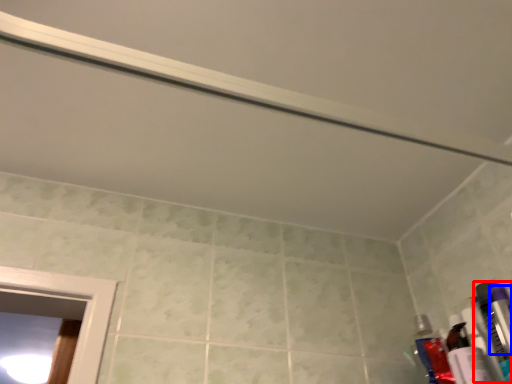
Question: Among these objects, which one is farthest to the camera, toiletry (highlighted by a red box) or toiletry (highlighted by a blue box)?

Choices:
 (A) toiletry
 (B) toiletry

Answer: (A)